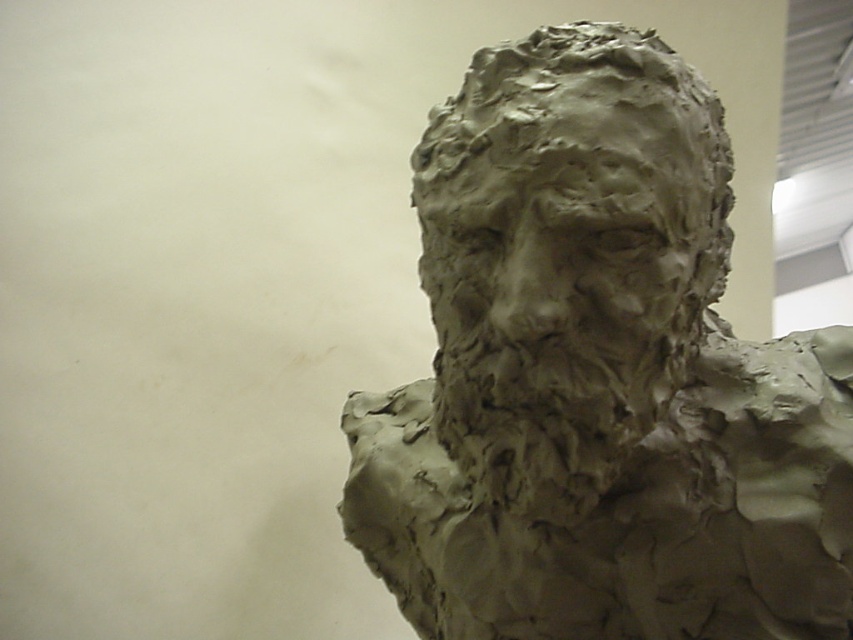
Consider the image. Is gray clay bust at center below clay sculpture at center?

Indeed, gray clay bust at center is positioned under clay sculpture at center.

Is gray clay bust at center further to the viewer compared to clay sculpture at center?

Yes.

Locate an element on the screen. The image size is (853, 640). gray clay bust at center is located at coordinates (598, 376).